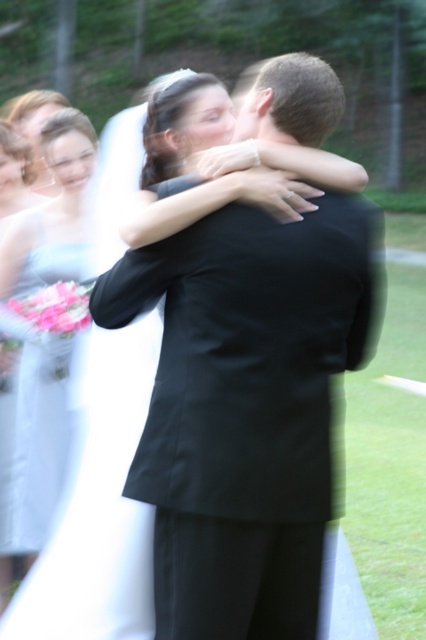
Who is higher up, white satin dress at left or matte white dress at left?

matte white dress at left

Is white satin dress at left shorter than matte white dress at left?

In fact, white satin dress at left may be taller than matte white dress at left.

Image resolution: width=426 pixels, height=640 pixels. I want to click on white satin dress at left, so click(51, 212).

I want to click on white satin dress at left, so click(x=51, y=212).

How much distance is there between black satin suit at center and matte white dress at left?

black satin suit at center is 8.53 feet away from matte white dress at left.

Based on the photo, can you confirm if black satin suit at center is positioned below matte white dress at left?

Correct, black satin suit at center is located below matte white dress at left.

At what (x,y) coordinates should I click in order to perform the action: click on black satin suit at center. Please return your answer as a coordinate pair (x, y). The width and height of the screenshot is (426, 640). Looking at the image, I should click on (247, 406).

Which is behind, point (204, 528) or point (66, 392)?

The point (66, 392) is behind.

Which is in front, point (170, 444) or point (40, 248)?

Positioned in front is point (170, 444).

What are the coordinates of `black satin suit at center` in the screenshot? It's located at (247, 406).